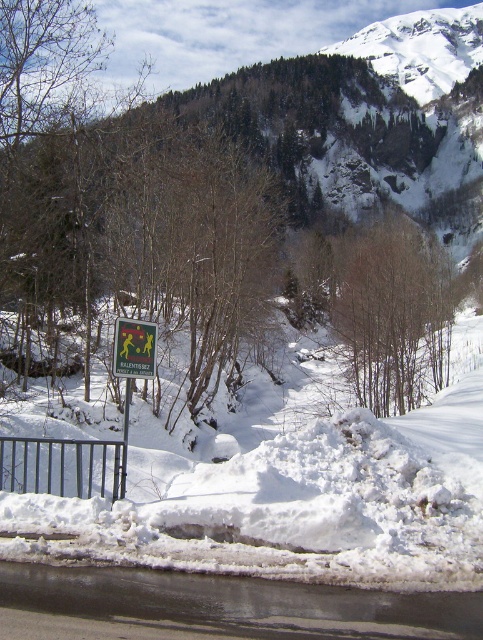
You are a skier planning to descend the slope. There is a point marked at coordinate (296, 492) on the slope. Based on the scene description, can you determine if this point is on the white snow ski slope at center?

Yes, the point marked at coordinate (296, 492) is on the white snow ski slope at center as stated in the description.